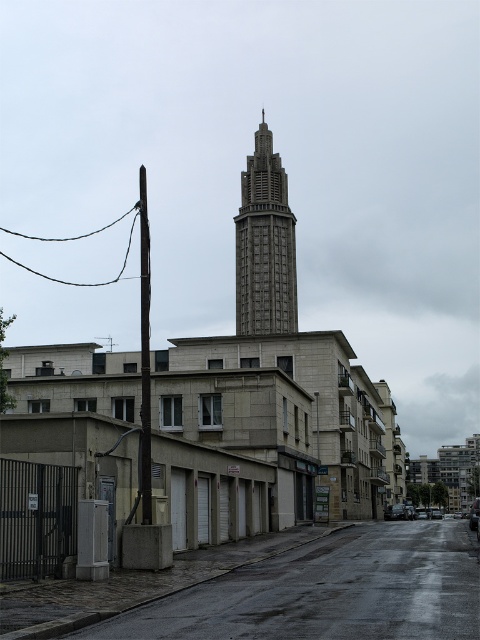
You are standing on the wet asphalt road in the urban street scene. There is a concrete wall at lower left marked by point (x=328, y=593). If you walk straight ahead, will you reach the tower in the background before encountering the concrete wall at lower left?

The concrete wall at lower left is represented by point (x=328, y=593). Since the tower is in the background and the wall is at the lower left, walking straight ahead would likely lead you toward the tower first before encountering the wall. However, the exact path depends on the layout, but based on the given point, the wall is positioned to the side rather than directly ahead. Therefore, you would reach the tower before the wall.

You are a delivery person trying to decide the best route to avoid the rain. You see a concrete wall at lower left and a gray concrete tower at center. Which structure can provide better shelter from the rain?

The gray concrete tower at center is taller than the concrete wall at lower left, so it can provide better shelter from the rain.

You are standing at the center of the image and want to walk towards the concrete wall at lower left. Which direction should you face to move directly towards it?

To move directly towards the concrete wall at lower left, you should face towards the lower left direction since the concrete wall at lower left is located at point (328,593) in the image.